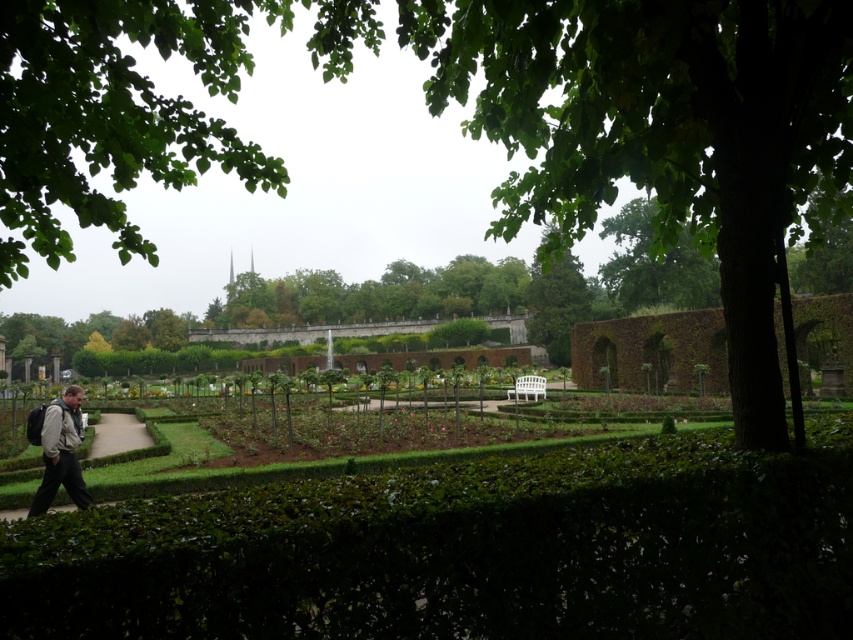
Question: Is green leafy tree at center above light brown leather jacket at lower left?

Choices:
 (A) no
 (B) yes

Answer: (B)

Question: Does green leafy tree at center have a larger size compared to light brown leather jacket at lower left?

Choices:
 (A) yes
 (B) no

Answer: (A)

Question: Which point is farther to the camera?

Choices:
 (A) (566, 292)
 (B) (82, 502)

Answer: (A)

Question: Is green leafy tree at center thinner than light brown leather jacket at lower left?

Choices:
 (A) no
 (B) yes

Answer: (A)